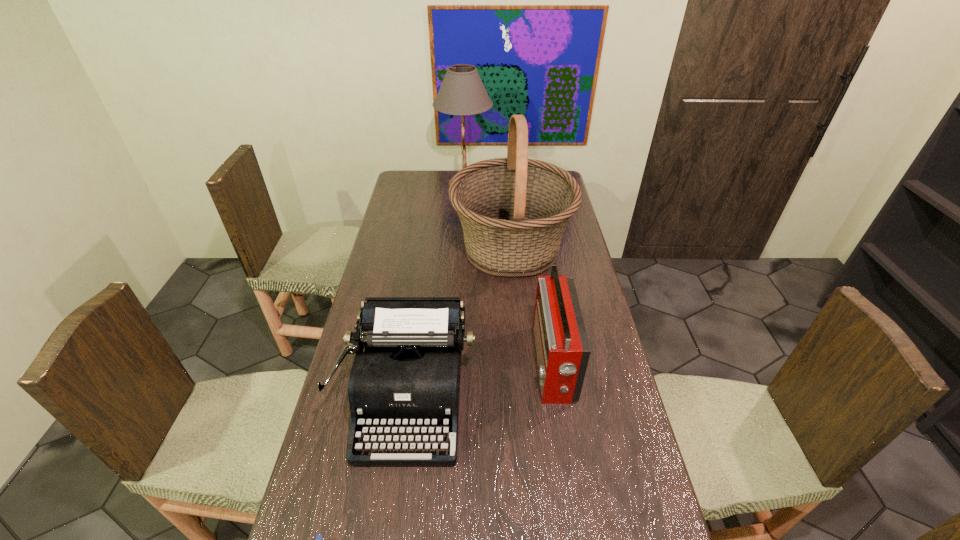
The height and width of the screenshot is (540, 960). What are the coordinates of `object that is the fourth closest to the basket` in the screenshot? It's located at (318, 539).

Where is `free region that satisfies the following two spatial constraints: 1. on the front-facing side of the farthest object; 2. on the typing side of the typewriter`? The width and height of the screenshot is (960, 540). free region that satisfies the following two spatial constraints: 1. on the front-facing side of the farthest object; 2. on the typing side of the typewriter is located at coordinates (454, 397).

You are a GUI agent. You are given a task and a screenshot of the screen. Output one action in this format:
    pyautogui.click(x=<x>, y=<y>)
    Task: Click on the vacant space that satisfies the following two spatial constraints: 1. on the front-facing side of the third tallest object; 2. on the typing side of the typewriter
    This screenshot has width=960, height=540.
    Given the screenshot: What is the action you would take?
    pyautogui.click(x=558, y=397)

Where is `vacant point that satisfies the following two spatial constraints: 1. on the front-facing side of the radio receiver; 2. on the typing side of the second shortest object`? This screenshot has height=540, width=960. vacant point that satisfies the following two spatial constraints: 1. on the front-facing side of the radio receiver; 2. on the typing side of the second shortest object is located at coordinates (558, 397).